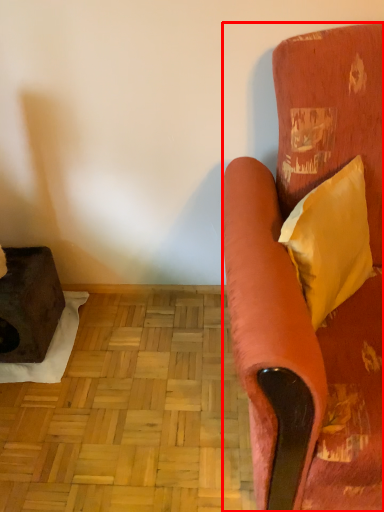
Question: Considering the relative positions of studio couch (annotated by the red box) and pillow in the image provided, where is studio couch (annotated by the red box) located with respect to the staircase?

Choices:
 (A) left
 (B) right

Answer: (B)